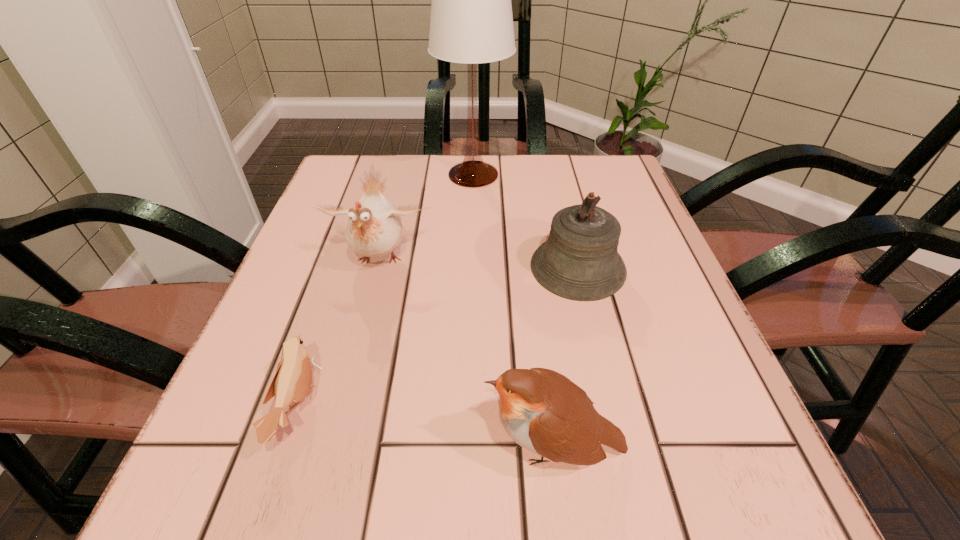
In order to click on vacant region located at the face of the rightmost bird in this screenshot , I will do `click(438, 447)`.

Find the location of a particular element. blank area located 0.110m at the face of the rightmost bird is located at coordinates coord(399,447).

Find the location of a particular element. Image resolution: width=960 pixels, height=540 pixels. free location located 0.340m at the beak of the shortest object is located at coordinates (557, 407).

In order to click on object at the far edge in this screenshot , I will do `click(471, 22)`.

I want to click on object positioned at the right edge, so click(x=580, y=261).

At what (x,y) coordinates should I click in order to perform the action: click on object that is positioned at the near left corner. Please return your answer as a coordinate pair (x, y). The height and width of the screenshot is (540, 960). Looking at the image, I should click on (292, 381).

Identify the location of free location at the far edge of the desktop. (506, 164).

The image size is (960, 540). I want to click on free spot at the left edge of the desktop, so click(337, 310).

You are a GUI agent. You are given a task and a screenshot of the screen. Output one action in this format:
    pyautogui.click(x=<x>, y=<y>)
    Task: Click on the free space at the right edge of the desktop
    The height and width of the screenshot is (540, 960).
    Given the screenshot: What is the action you would take?
    pyautogui.click(x=642, y=350)

What are the coordinates of `vacant space at the far left corner of the desktop` in the screenshot? It's located at (384, 164).